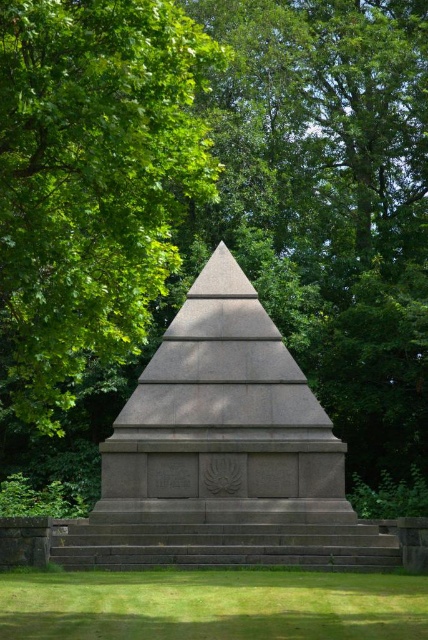
You are standing at point [92,182] in the park. What do you see directly in front of you?

You see a green leafy tree at center directly in front of you at point [92,182].

Looking at this image, you are a landscape architect designing a new garden. You want to place a statue exactly halfway between the green leafy tree at center and the green grass at lower center. Will the statue be closer to the ground or the sky? Explain your reasoning.

The statue will be closer to the ground because the green leafy tree at center is taller than the green grass at lower center. Since the statue is placed halfway between them vertically, it will be at a lower elevation compared to the tree but higher than the grass. However, since the grass is much shorter, the midpoint would still be closer to the ground level than the tree top.